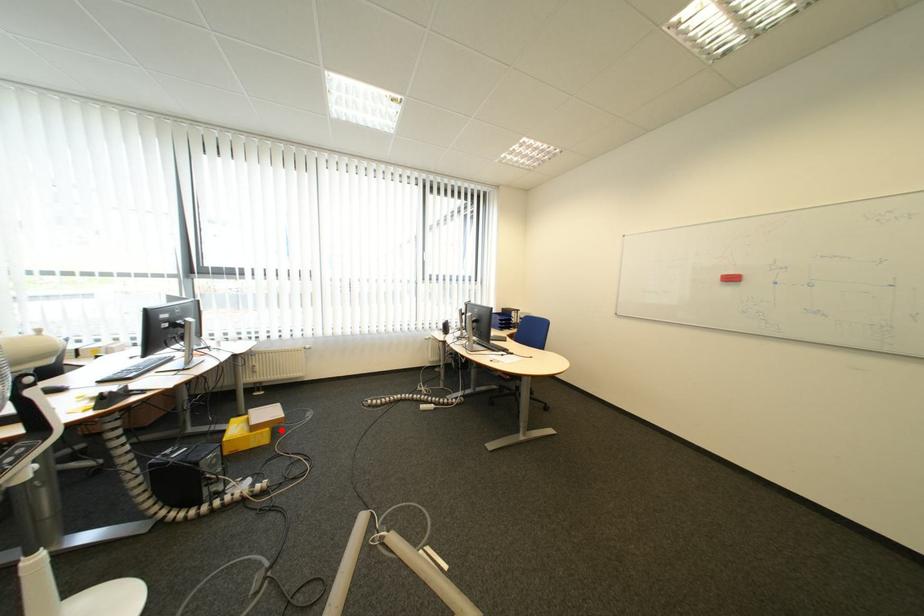
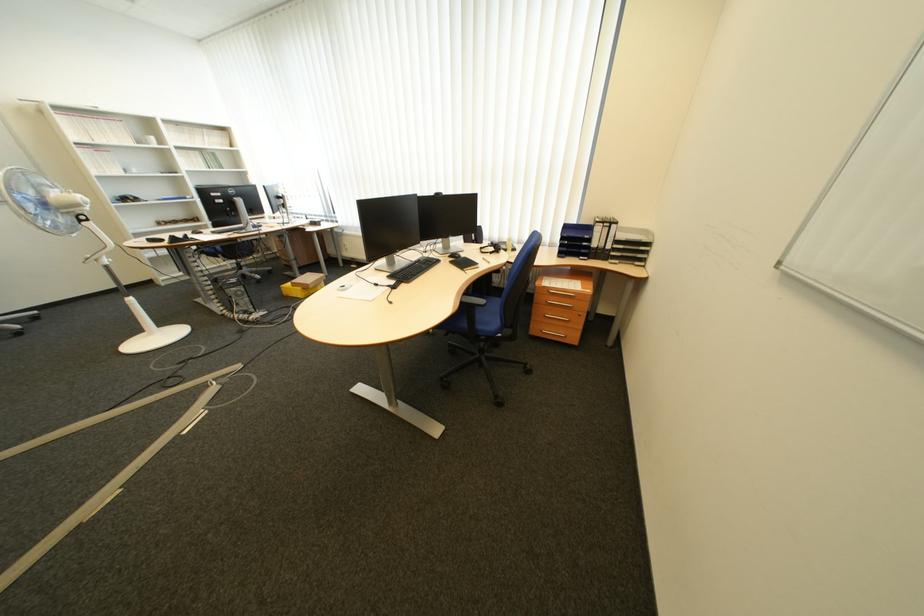
Locate, in the second image, the point that corresponds to the highlighted location in the first image.

(313, 290)